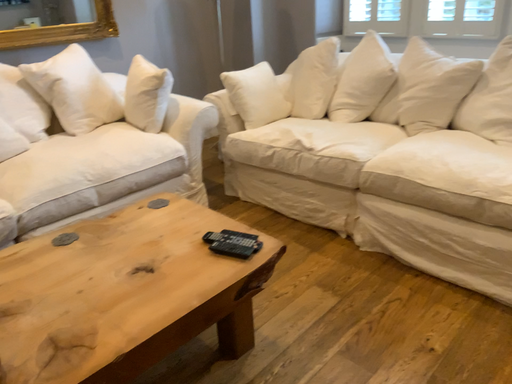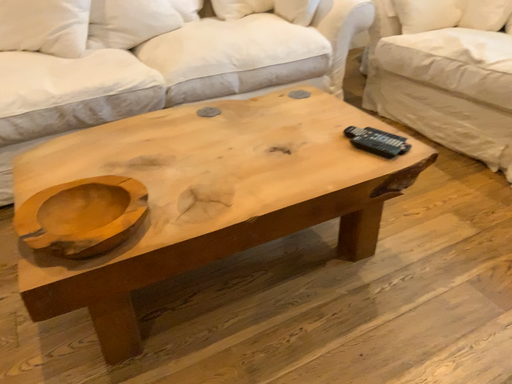
Question: How did the camera likely rotate when shooting the video?

Choices:
 (A) rotated right
 (B) rotated left

Answer: (B)